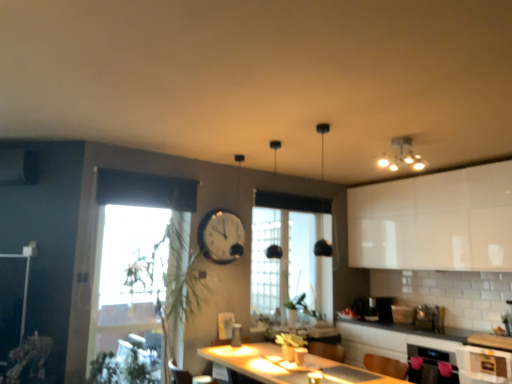
Looking at this image, how much space does white glossy cabinet at lower right, the second cabinetry viewed from the back, occupy vertically?

10.57 inches.

This screenshot has height=384, width=512. What do you see at coordinates (390, 341) in the screenshot? I see `white glossy countertop at lower right` at bounding box center [390, 341].

Identify the location of green leafy plant at lower left. (124, 367).

Find the location of a particular element. The image size is (512, 384). clear glass window at center, the 1th window positioned from the back is located at coordinates (291, 253).

Where is `white glossy cabinet at upper right, the first cabinetry in the back-to-front sequence`? This screenshot has width=512, height=384. white glossy cabinet at upper right, the first cabinetry in the back-to-front sequence is located at coordinates (434, 221).

The image size is (512, 384). What do you see at coordinates (434, 221) in the screenshot? I see `white glossy cabinet at upper right, marked as the 2th cabinetry in a front-to-back arrangement` at bounding box center [434, 221].

Locate an element on the screen. white glossy cabinet at lower right, placed as the first cabinetry when sorted from front to back is located at coordinates pyautogui.click(x=483, y=365).

From the image's perspective, is matte white light fixture at upper right located above or below white glossy countertop at lower right?

matte white light fixture at upper right is situated higher than white glossy countertop at lower right in the image.

Are matte white light fixture at upper right and white glossy countertop at lower right located far from each other?

Yes, matte white light fixture at upper right is far from white glossy countertop at lower right.

Considering the relative positions of matte white light fixture at upper right and white glossy countertop at lower right in the image provided, is matte white light fixture at upper right behind white glossy countertop at lower right?

No, it is not.

Between matte white light fixture at upper right and white glossy countertop at lower right, which one has larger width?

With larger width is white glossy countertop at lower right.

From the image's perspective, is white glossy countertop at lower right above or below clear glass window at center, marked as the 2th window in a front-to-back arrangement?

white glossy countertop at lower right is below clear glass window at center, marked as the 2th window in a front-to-back arrangement.

I want to click on the 2nd window above the white glossy countertop at lower right (from a real-world perspective), so click(291, 253).

Between white glossy countertop at lower right and clear glass window at center, which ranks as the second window in left-to-right order, which one is positioned in front?

white glossy countertop at lower right is closer to the camera.

From a real-world perspective, which object rests below the other?

white glossy countertop at lower right is physically lower.

Does green leafy plant at lower left lie behind white glossy countertop at lower right?

No, green leafy plant at lower left is closer to the viewer.

Which of these two, green leafy plant at lower left or white glossy countertop at lower right, is bigger?

white glossy countertop at lower right is bigger.

Is green leafy plant at lower left in contact with white glossy countertop at lower right?

green leafy plant at lower left and white glossy countertop at lower right are clearly separated.

Considering the positions of point (129, 358) and point (343, 327), is point (129, 358) closer or farther from the camera than point (343, 327)?

Point (129, 358) appears to be closer to the viewer than point (343, 327).

Between white glossy cabinet at lower right, the second cabinetry viewed from the back, and metallic silver clock at center, which one has more height?

metallic silver clock at center is taller.

Is white glossy cabinet at lower right, placed as the first cabinetry when sorted from front to back, not near metallic silver clock at center?

Yes, white glossy cabinet at lower right, placed as the first cabinetry when sorted from front to back, is far from metallic silver clock at center.

Is white glossy cabinet at lower right, the 2th cabinetry in the top-to-bottom sequence, not inside metallic silver clock at center?

Yes, white glossy cabinet at lower right, the 2th cabinetry in the top-to-bottom sequence, is located beyond the bounds of metallic silver clock at center.

Which object is positioned more to the left, white glossy cabinet at lower right, placed as the first cabinetry when sorted from front to back, or metallic silver clock at center?

metallic silver clock at center is more to the left.

Is point (230, 249) in front of point (444, 342)?

That is False.

Would you say metallic silver clock at center is outside white glossy countertop at lower right?

Yes, metallic silver clock at center is outside of white glossy countertop at lower right.

Which is more to the right, metallic silver clock at center or white glossy countertop at lower right?

From the viewer's perspective, white glossy countertop at lower right appears more on the right side.

Identify the location of plant below the transparent glass window at left, which is the 1th window from left to right (from a real-world perspective). The height and width of the screenshot is (384, 512). (124, 367).

From a real-world perspective, is transparent glass window at left, positioned as the 2th window in right-to-left order, positioned above or below green leafy plant at lower left?

Clearly, from a real-world perspective, transparent glass window at left, positioned as the 2th window in right-to-left order, is above green leafy plant at lower left.

Between transparent glass window at left, positioned as the 2th window in right-to-left order, and green leafy plant at lower left, which one is positioned behind?

Positioned behind is green leafy plant at lower left.

From a real-world perspective, is green leafy plant at lower left located higher than white glossy cabinet at upper right, the second cabinetry in the bottom-to-top sequence?

Actually, green leafy plant at lower left is physically below white glossy cabinet at upper right, the second cabinetry in the bottom-to-top sequence, in the real world.

Which point is more distant from viewer, (98, 362) or (423, 184)?

Positioned behind is point (423, 184).

Can we say green leafy plant at lower left lies outside white glossy cabinet at upper right, the first cabinetry in the back-to-front sequence?

Yes, green leafy plant at lower left is located beyond the bounds of white glossy cabinet at upper right, the first cabinetry in the back-to-front sequence.

The width and height of the screenshot is (512, 384). Find the location of `light fixture above the white glossy countertop at lower right (from a real-world perspective)`. light fixture above the white glossy countertop at lower right (from a real-world perspective) is located at coordinates (402, 155).

Locate an element on the screen. countertop that is below the clear glass window at center, the 1th window positioned from the back (from the image's perspective) is located at coordinates pyautogui.click(x=390, y=341).

From the image, which object appears to be farther from white glossy cabinet at lower right, positioned as the first cabinetry in bottom-to-top order, white glossy countertop at lower right or metallic silver clock at center?

metallic silver clock at center is positioned further to the anchor white glossy cabinet at lower right, positioned as the first cabinetry in bottom-to-top order.

From the image, which object appears to be nearer to green leafy plant at lower left, white glossy cabinet at lower right, positioned as the first cabinetry in bottom-to-top order, or transparent glass window at left, which is counted as the 1th window, starting from the front?

The object closer to green leafy plant at lower left is transparent glass window at left, which is counted as the 1th window, starting from the front.

Based on their spatial positions, is green leafy plant at lower left or white glossy countertop at lower right closer to clear glass window at center, the 1th window positioned from the back?

Among the two, white glossy countertop at lower right is located nearer to clear glass window at center, the 1th window positioned from the back.

From the image, which object appears to be nearer to metallic silver clock at center, white glossy cabinet at lower right, positioned as the first cabinetry in bottom-to-top order, or clear glass window at center, the 1th window positioned from the back?

Among the two, clear glass window at center, the 1th window positioned from the back, is located nearer to metallic silver clock at center.

Estimate the real-world distances between objects in this image. Which object is closer to white glossy cabinet at upper right, arranged as the 1th cabinetry when viewed from the top, matte white light fixture at upper right or green leafy plant at lower left?

matte white light fixture at upper right lies closer to white glossy cabinet at upper right, arranged as the 1th cabinetry when viewed from the top, than the other object.

From the image, which object appears to be farther from white glossy countertop at lower right, clear glass window at center, which is the 1th window from right to left, or white glossy cabinet at upper right, the first cabinetry in the back-to-front sequence?

The object further to white glossy countertop at lower right is white glossy cabinet at upper right, the first cabinetry in the back-to-front sequence.

Based on their spatial positions, is matte white light fixture at upper right or white glossy countertop at lower right closer to green leafy plant at lower left?

The object closer to green leafy plant at lower left is white glossy countertop at lower right.

From the image, which object appears to be nearer to white glossy cabinet at lower right, the second cabinetry viewed from the back, white glossy cabinet at upper right, the second cabinetry in the bottom-to-top sequence, or transparent glass window at left, which is the 1th window from left to right?

white glossy cabinet at upper right, the second cabinetry in the bottom-to-top sequence.

This screenshot has height=384, width=512. What are the coordinates of `window between transparent glass window at left, which is counted as the 1th window, starting from the front, and white glossy cabinet at lower right, placed as the first cabinetry when sorted from front to back` in the screenshot? It's located at (291, 253).

The height and width of the screenshot is (384, 512). Find the location of `window located between metallic silver clock at center and matte white light fixture at upper right in the left-right direction`. window located between metallic silver clock at center and matte white light fixture at upper right in the left-right direction is located at coordinates (291, 253).

Image resolution: width=512 pixels, height=384 pixels. What are the coordinates of `clock between green leafy plant at lower left and white glossy cabinet at lower right, positioned as the first cabinetry in bottom-to-top order, in the horizontal direction` in the screenshot? It's located at (221, 236).

Identify the location of plant located between transparent glass window at left, the 2th window viewed from the back, and clear glass window at center, which ranks as the second window in left-to-right order, in the depth direction. pos(124,367).